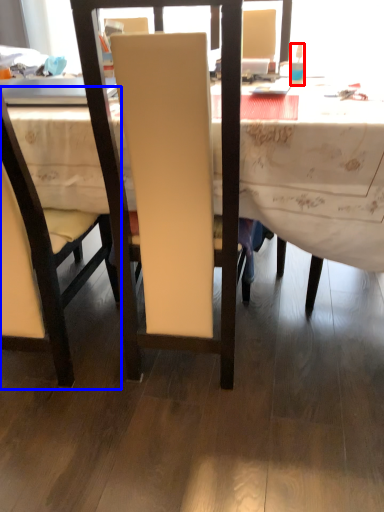
Question: Which object appears farthest to the camera in this image, bottle (highlighted by a red box) or chair (highlighted by a blue box)?

Choices:
 (A) bottle
 (B) chair

Answer: (A)